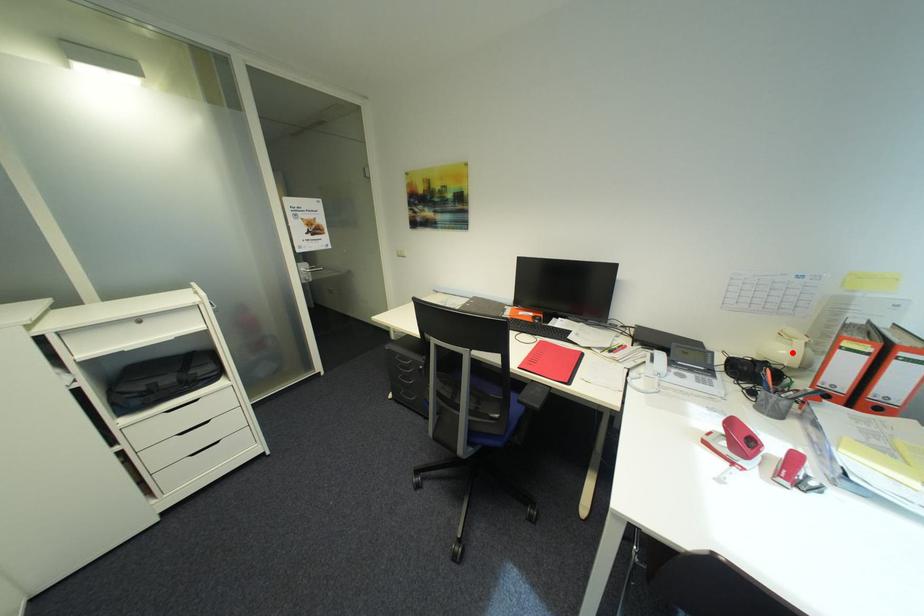
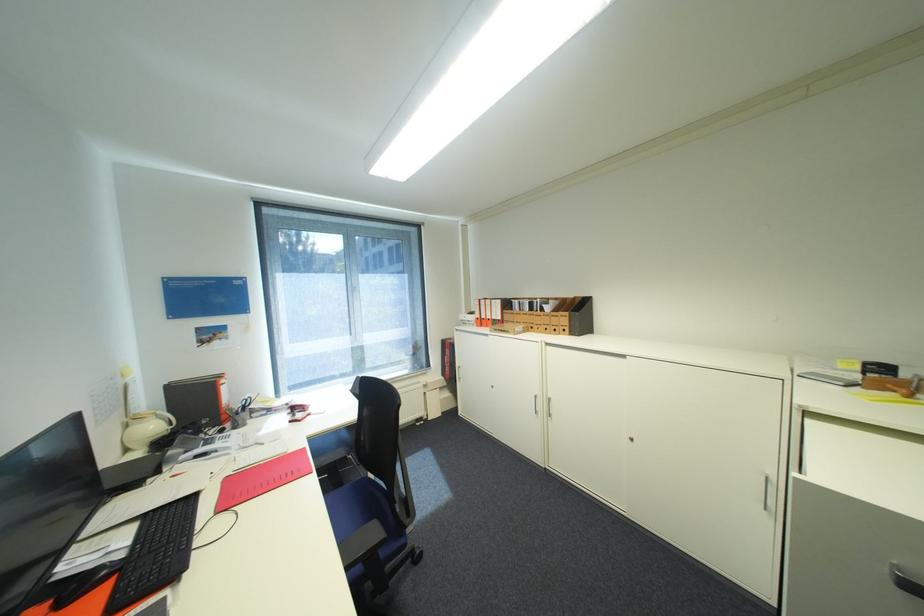
The point at the highlighted location is marked in the first image. Where is the corresponding point in the second image?

(161, 427)